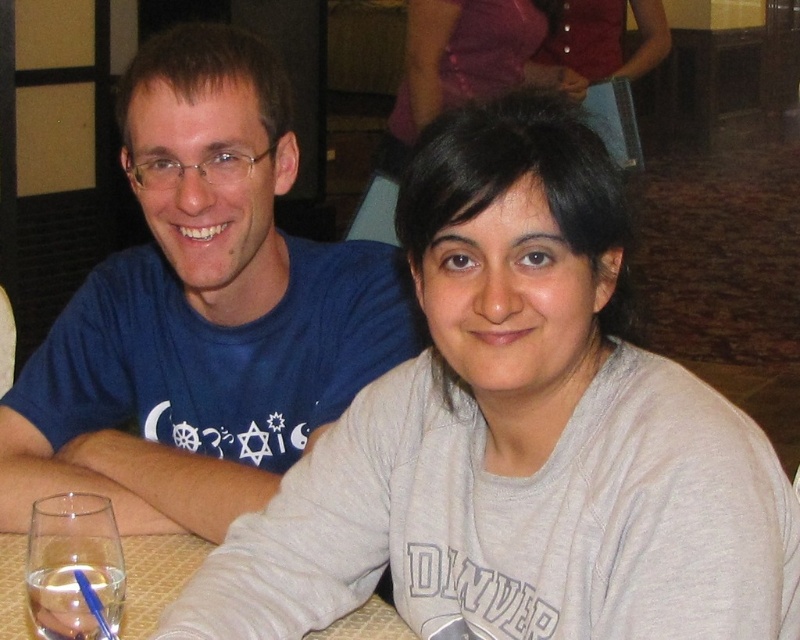
Question: Is matte purple blouse at upper center to the right of clear glass wine glass at lower left from the viewer's perspective?

Choices:
 (A) no
 (B) yes

Answer: (B)

Question: Which point appears closest to the camera in this image?

Choices:
 (A) (292, 131)
 (B) (626, 61)
 (C) (84, 632)

Answer: (C)

Question: Can you confirm if blue cotton t-shirt at left is positioned below clear glass wine glass at lower left?

Choices:
 (A) yes
 (B) no

Answer: (B)

Question: Among these points, which one is nearest to the camera?

Choices:
 (A) (60, 608)
 (B) (356, 632)
 (C) (617, 604)
 (D) (412, 84)

Answer: (C)

Question: Can you confirm if gray cotton sweatshirt at center is thinner than blue cotton t-shirt at left?

Choices:
 (A) no
 (B) yes

Answer: (A)

Question: Which of the following is the closest to the observer?

Choices:
 (A) (513, 74)
 (B) (285, 163)
 (C) (517, 595)
 (D) (16, 557)

Answer: (C)